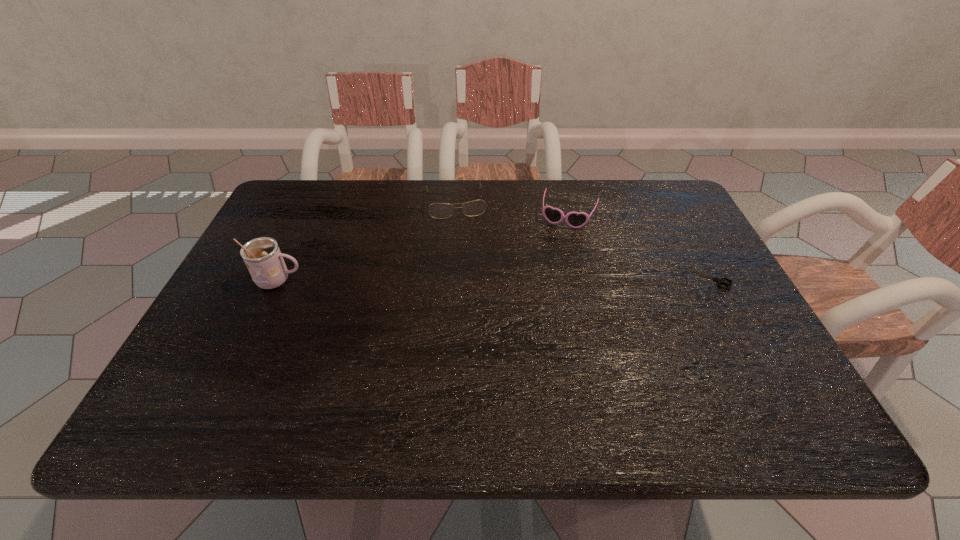
The image size is (960, 540). Identify the location of free space on the desktop that is between the cup and the shortest object and is positioned on the front-facing side of the third object from right to left. (468, 280).

I want to click on free space on the desktop that is between the leftmost object and the shears and is positioned on the front-facing side of the third object from left to right, so click(x=547, y=279).